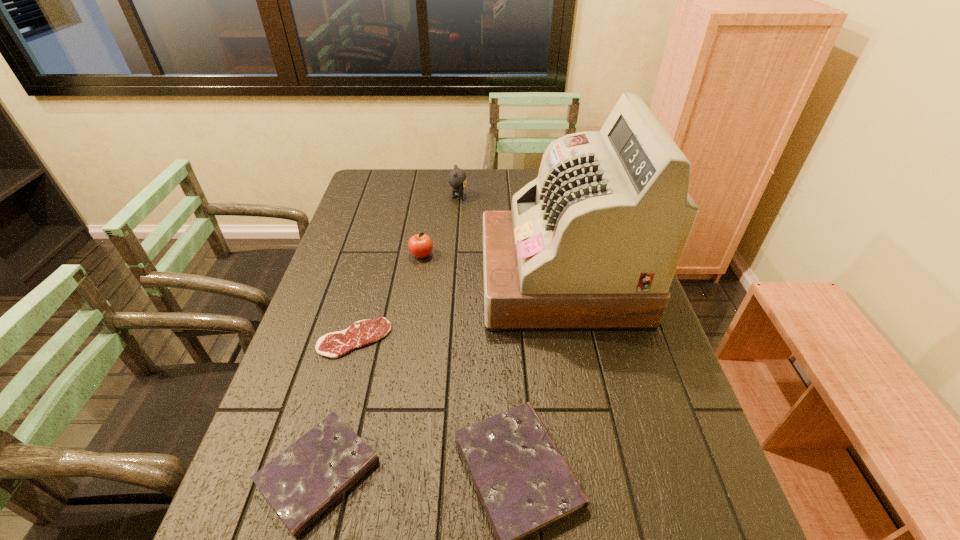
You are a GUI agent. You are given a task and a screenshot of the screen. Output one action in this format:
    pyautogui.click(x=<x>, y=<y>)
    Task: Click on the object that stands as the closest to the cash register
    Image resolution: width=960 pixels, height=540 pixels.
    Given the screenshot: What is the action you would take?
    pyautogui.click(x=420, y=245)

Identify which object is located as the fifth nearest to the apple. Please provide its 2D coordinates. Your answer should be formatted as a tuple, i.e. [(x, y)], where the tuple contains the x and y coordinates of a point satisfying the conditions above.

[(301, 483)]

Find the location of `vacant region that satisfies the following two spatial constraints: 1. on the operating side of the cash register; 2. on the front side of the steak`. vacant region that satisfies the following two spatial constraints: 1. on the operating side of the cash register; 2. on the front side of the steak is located at coordinates (573, 339).